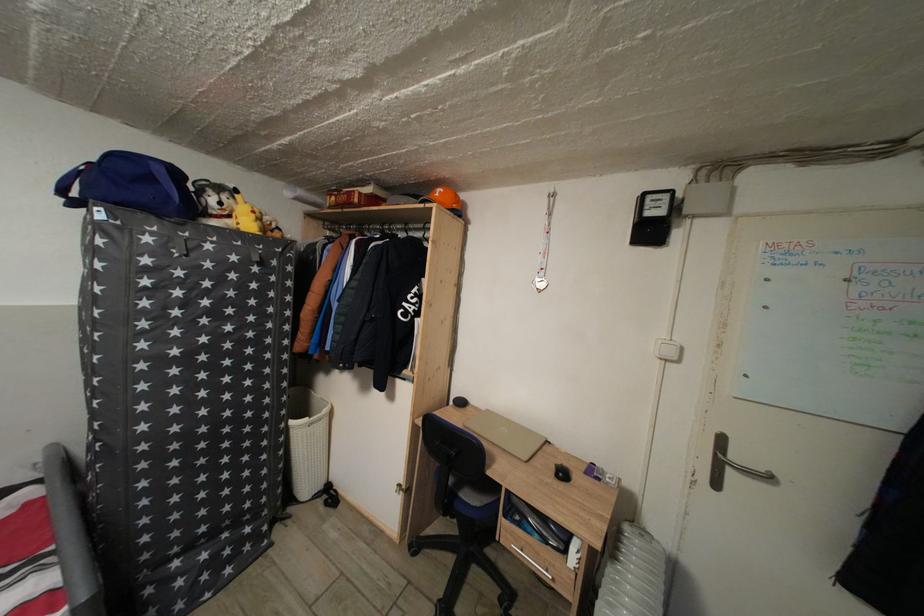
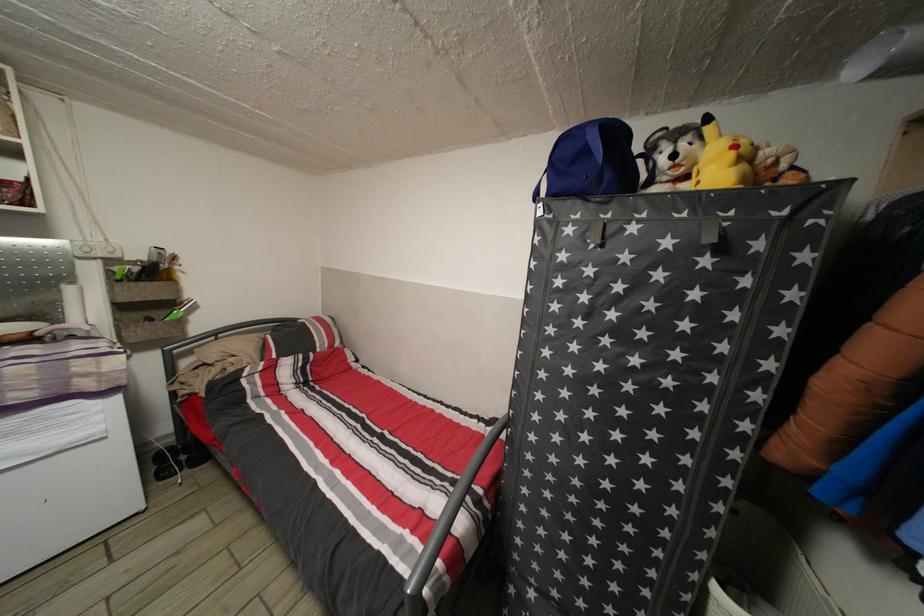
Locate, in the second image, the point that corresponds to pixel 215 253 in the first image.

(639, 235)